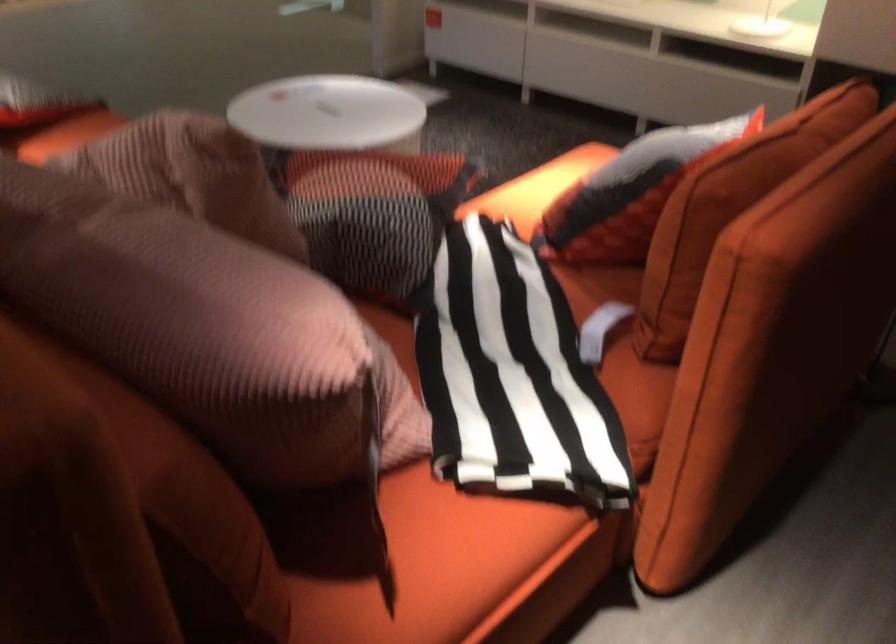
What do you see at coordinates (771, 346) in the screenshot? The image size is (896, 644). I see `the sofa armrest` at bounding box center [771, 346].